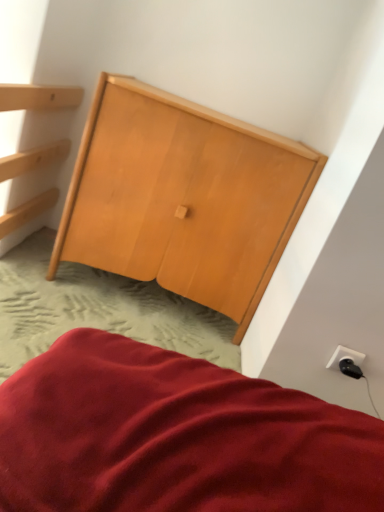
Question: From a real-world perspective, is black plastic plug at lower right positioned over white plastic outlet at lower right based on gravity?

Choices:
 (A) yes
 (B) no

Answer: (B)

Question: Can you confirm if black plastic plug at lower right is taller than white plastic outlet at lower right?

Choices:
 (A) no
 (B) yes

Answer: (A)

Question: Is the depth of black plastic plug at lower right greater than that of white plastic outlet at lower right?

Choices:
 (A) yes
 (B) no

Answer: (B)

Question: Does black plastic plug at lower right have a larger size compared to white plastic outlet at lower right?

Choices:
 (A) no
 (B) yes

Answer: (A)

Question: Can you confirm if black plastic plug at lower right is thinner than white plastic outlet at lower right?

Choices:
 (A) no
 (B) yes

Answer: (A)

Question: From a real-world perspective, is natural wood wardrobe at center positioned above or below black plastic plug at lower right?

Choices:
 (A) below
 (B) above

Answer: (B)

Question: Considering the positions of natural wood wardrobe at center and black plastic plug at lower right in the image, is natural wood wardrobe at center taller or shorter than black plastic plug at lower right?

Choices:
 (A) short
 (B) tall

Answer: (B)

Question: Does point (117, 237) appear closer or farther from the camera than point (342, 369)?

Choices:
 (A) closer
 (B) farther

Answer: (B)

Question: Is natural wood wardrobe at center spatially inside black plastic plug at lower right, or outside of it?

Choices:
 (A) inside
 (B) outside

Answer: (B)

Question: From a real-world perspective, relative to black plastic plug at lower right, is white plastic outlet at lower right vertically above or below?

Choices:
 (A) above
 (B) below

Answer: (A)

Question: Is white plastic outlet at lower right inside or outside of black plastic plug at lower right?

Choices:
 (A) outside
 (B) inside

Answer: (A)

Question: Looking at the image, does white plastic outlet at lower right seem bigger or smaller compared to black plastic plug at lower right?

Choices:
 (A) big
 (B) small

Answer: (A)

Question: From the image's perspective, is white plastic outlet at lower right located above or below black plastic plug at lower right?

Choices:
 (A) below
 (B) above

Answer: (B)

Question: In the image, is black plastic plug at lower right on the left side or the right side of white plastic outlet at lower right?

Choices:
 (A) left
 (B) right

Answer: (A)

Question: From a real-world perspective, is black plastic plug at lower right above or below white plastic outlet at lower right?

Choices:
 (A) above
 (B) below

Answer: (B)